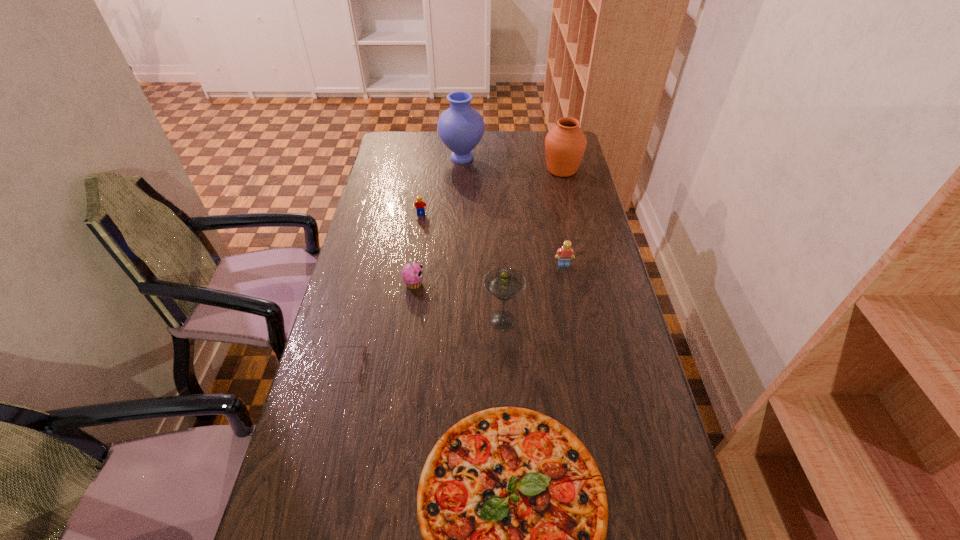
Find the location of a particular element. object that is the third closest to the second nearest object is located at coordinates (504, 283).

In order to click on free region that satisfies the following two spatial constraints: 1. on the front-facing side of the left Lego; 2. on the face of the second nearest object in this screenshot , I will do `click(398, 368)`.